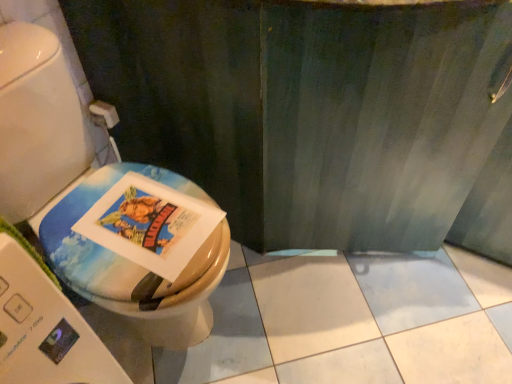
Question: Can you see white matte toilet paper at upper left touching matte plastic toilet at left?

Choices:
 (A) no
 (B) yes

Answer: (A)

Question: Considering the relative positions of white matte toilet paper at upper left and matte plastic toilet at left in the image provided, is white matte toilet paper at upper left to the left of matte plastic toilet at left from the viewer's perspective?

Choices:
 (A) no
 (B) yes

Answer: (B)

Question: Is white matte toilet paper at upper left located outside matte plastic toilet at left?

Choices:
 (A) yes
 (B) no

Answer: (A)

Question: From a real-world perspective, is white matte toilet paper at upper left below matte plastic toilet at left?

Choices:
 (A) yes
 (B) no

Answer: (A)

Question: From the image's perspective, is white matte toilet paper at upper left beneath matte plastic toilet at left?

Choices:
 (A) no
 (B) yes

Answer: (A)

Question: Choose the correct answer: Is matte plastic toilet at left inside white matte toilet paper at upper left or outside it?

Choices:
 (A) inside
 (B) outside

Answer: (B)

Question: Looking at their shapes, would you say matte plastic toilet at left is wider or thinner than white matte toilet paper at upper left?

Choices:
 (A) wide
 (B) thin

Answer: (A)

Question: From the image's perspective, relative to white matte toilet paper at upper left, is matte plastic toilet at left above or below?

Choices:
 (A) above
 (B) below

Answer: (B)

Question: Looking at the image, does matte plastic toilet at left seem bigger or smaller compared to white matte toilet paper at upper left?

Choices:
 (A) small
 (B) big

Answer: (B)

Question: From a real-world perspective, is white matte toilet paper at upper left positioned above or below matte plastic toilet at left?

Choices:
 (A) above
 (B) below

Answer: (B)

Question: Is white matte toilet paper at upper left in front of or behind matte plastic toilet at left in the image?

Choices:
 (A) front
 (B) behind

Answer: (B)

Question: From the image's perspective, relative to matte plastic toilet at left, is white matte toilet paper at upper left above or below?

Choices:
 (A) above
 (B) below

Answer: (A)

Question: Considering the positions of white matte toilet paper at upper left and matte plastic toilet at left in the image, is white matte toilet paper at upper left taller or shorter than matte plastic toilet at left?

Choices:
 (A) short
 (B) tall

Answer: (A)

Question: Is matte plastic toilet at left to the left or to the right of matte paper comic book at center in the image?

Choices:
 (A) right
 (B) left

Answer: (B)

Question: Looking at their shapes, would you say matte plastic toilet at left is wider or thinner than matte paper comic book at center?

Choices:
 (A) wide
 (B) thin

Answer: (A)